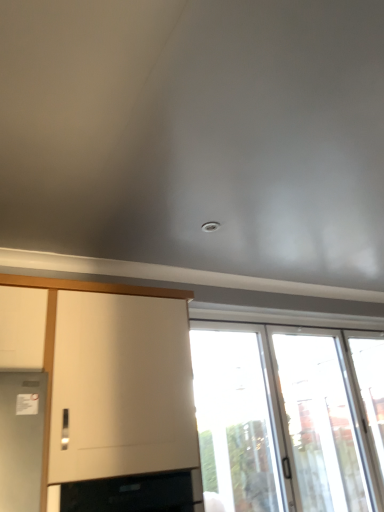
Question: Is transparent glass window at lower right, the 1th window in the left-to-right sequence, placed right next to transparent glass door at right, which is counted as the 2th window, starting from the left?

Choices:
 (A) no
 (B) yes

Answer: (A)

Question: Is transparent glass window at lower right, the 1th window in the left-to-right sequence, thinner than transparent glass door at right, which is counted as the 2th window, starting from the left?

Choices:
 (A) yes
 (B) no

Answer: (A)

Question: From a real-world perspective, is transparent glass window at lower right, which ranks as the 2th window in right-to-left order, physically above transparent glass door at right, positioned as the first window in right-to-left order?

Choices:
 (A) yes
 (B) no

Answer: (A)

Question: From a real-world perspective, does transparent glass window at lower right, the 1th window in the left-to-right sequence, sit lower than transparent glass door at right, positioned as the first window in right-to-left order?

Choices:
 (A) no
 (B) yes

Answer: (A)

Question: Can you confirm if transparent glass window at lower right, the 1th window in the left-to-right sequence, is shorter than transparent glass door at right, which is counted as the 2th window, starting from the left?

Choices:
 (A) yes
 (B) no

Answer: (B)

Question: From the image's perspective, is transparent glass screen door at right above or below transparent glass window at lower right, the 1th window in the left-to-right sequence?

Choices:
 (A) above
 (B) below

Answer: (B)

Question: In the image, is transparent glass screen door at right positioned in front of or behind transparent glass window at lower right, the 1th window in the left-to-right sequence?

Choices:
 (A) behind
 (B) front

Answer: (A)

Question: From their relative heights in the image, would you say transparent glass screen door at right is taller or shorter than transparent glass window at lower right, the 1th window in the left-to-right sequence?

Choices:
 (A) tall
 (B) short

Answer: (B)

Question: Considering the positions of point (334, 403) and point (314, 402), is point (334, 403) closer or farther from the camera than point (314, 402)?

Choices:
 (A) closer
 (B) farther

Answer: (B)

Question: Based on their sizes in the image, would you say black glass oven at lower left is bigger or smaller than transparent glass window at lower right, which ranks as the 2th window in right-to-left order?

Choices:
 (A) big
 (B) small

Answer: (B)

Question: From the image's perspective, is black glass oven at lower left located above or below transparent glass window at lower right, the 1th window in the left-to-right sequence?

Choices:
 (A) above
 (B) below

Answer: (A)

Question: Is black glass oven at lower left to the left or to the right of transparent glass window at lower right, which ranks as the 2th window in right-to-left order, in the image?

Choices:
 (A) left
 (B) right

Answer: (A)

Question: Is point (182, 485) positioned closer to the camera than point (317, 477)?

Choices:
 (A) closer
 (B) farther

Answer: (A)

Question: Is transparent glass door at right, positioned as the first window in right-to-left order, spatially inside transparent glass screen door at right, or outside of it?

Choices:
 (A) inside
 (B) outside

Answer: (B)

Question: From the image's perspective, relative to transparent glass screen door at right, is transparent glass door at right, positioned as the first window in right-to-left order, above or below?

Choices:
 (A) above
 (B) below

Answer: (B)